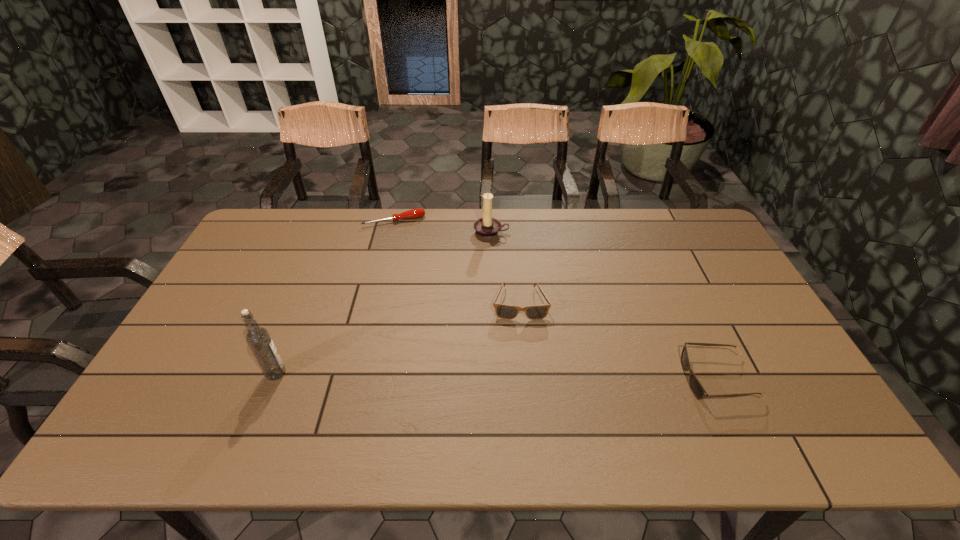
Locate an element on the screen. The image size is (960, 540). vacant spot on the desktop that is between the tallest object and the second shortest object and is positioned at the tip of the fourth object from right to left is located at coordinates (442, 375).

Where is `vacant space on the desktop that is between the vodka and the right sunglasses and is positioned on the wick of the candle holder`? The image size is (960, 540). vacant space on the desktop that is between the vodka and the right sunglasses and is positioned on the wick of the candle holder is located at coordinates (463, 375).

Image resolution: width=960 pixels, height=540 pixels. In order to click on free spot on the desktop that is between the leftmost object and the fourth tallest object and is positioned on the frames of the third farthest object in this screenshot , I will do `click(524, 376)`.